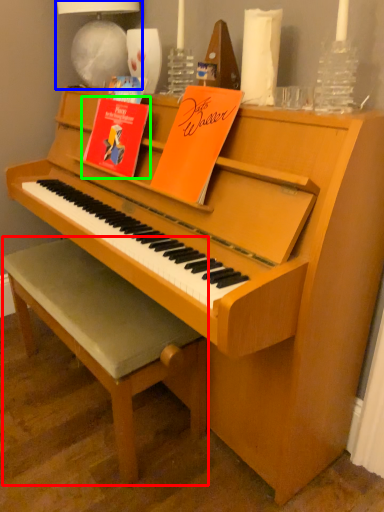
Question: Considering the real-world distances, which object is farthest from stool (highlighted by a red box)? lamp (highlighted by a blue box) or paperback book (highlighted by a green box)?

Choices:
 (A) lamp
 (B) paperback book

Answer: (A)